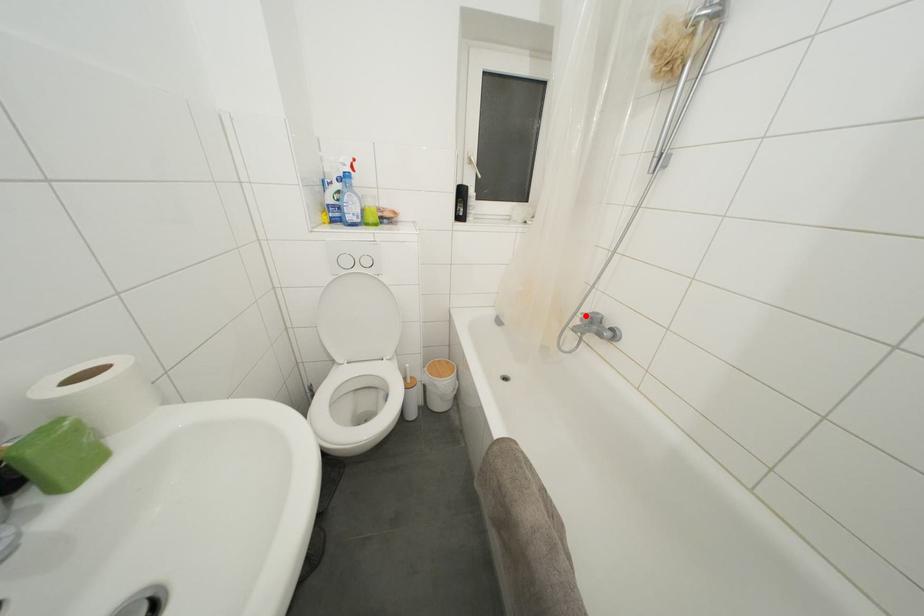
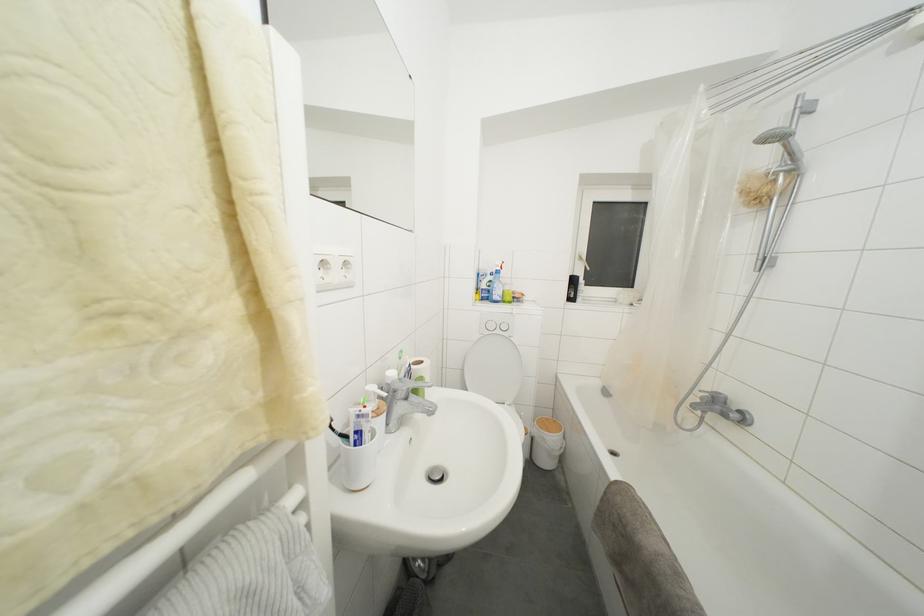
In the second image, find the point that corresponds to the highlighted location in the first image.

(703, 392)